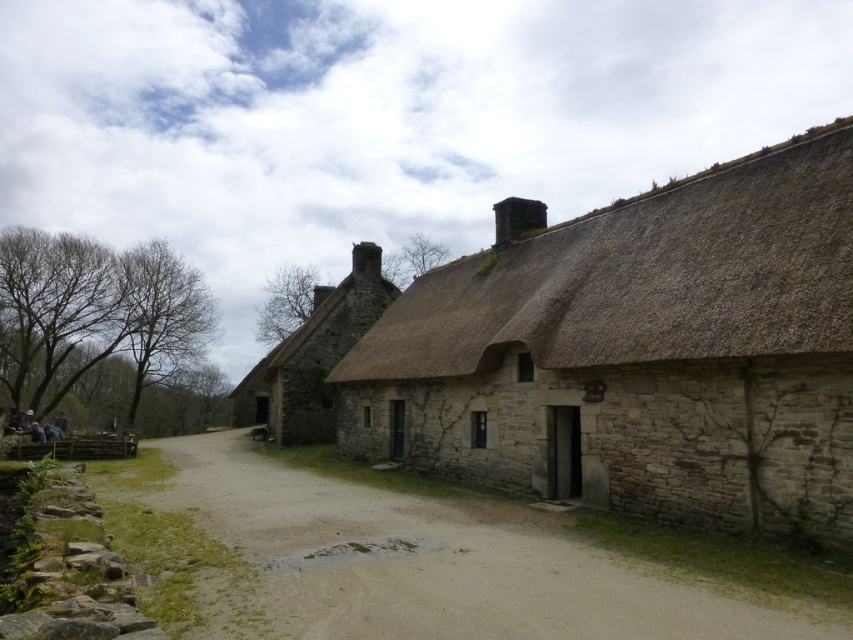
Between brown thatch roof at upper right and stone thatched cottage at center, which one has more height?

With more height is stone thatched cottage at center.

Is brown thatch roof at upper right positioned in front of stone thatched cottage at center?

Yes, it is in front of stone thatched cottage at center.

Describe the element at coordinates (645, 278) in the screenshot. I see `brown thatch roof at upper right` at that location.

Identify the location of brown thatch roof at upper right. This screenshot has width=853, height=640. [x=645, y=278].